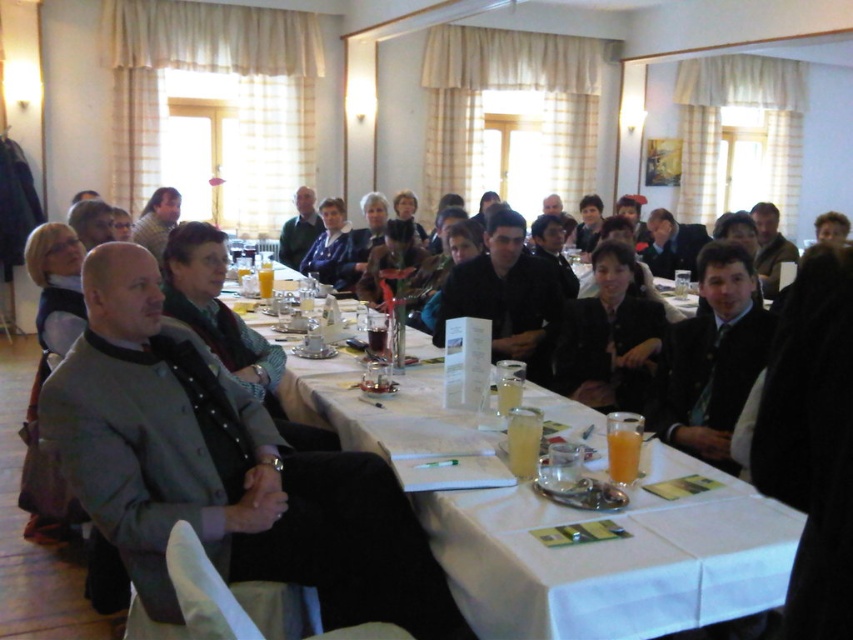
Question: Which of these objects is positioned closest to the matte black vest at center?

Choices:
 (A) black fabric jacket at center
 (B) white cloth table at center
 (C) black matte jacket at center

Answer: (A)

Question: Which object is the closest to the black matte jacket at center?

Choices:
 (A) black fabric jacket at center
 (B) white cloth table at center
 (C) gray woolen jacket at center

Answer: (A)

Question: Is gray woolen jacket at center wider than white cloth table at center?

Choices:
 (A) no
 (B) yes

Answer: (A)

Question: Does black matte jacket at center have a smaller size compared to green textured sweater at upper center?

Choices:
 (A) no
 (B) yes

Answer: (B)

Question: Is gray woolen jacket at center below black matte jacket at center?

Choices:
 (A) yes
 (B) no

Answer: (A)

Question: Estimate the real-world distances between objects in this image. Which object is farther from the gray woolen jacket at center?

Choices:
 (A) black matte jacket at center
 (B) black fabric jacket at center
 (C) green textured sweater at upper center
 (D) matte black jacket at center

Answer: (D)